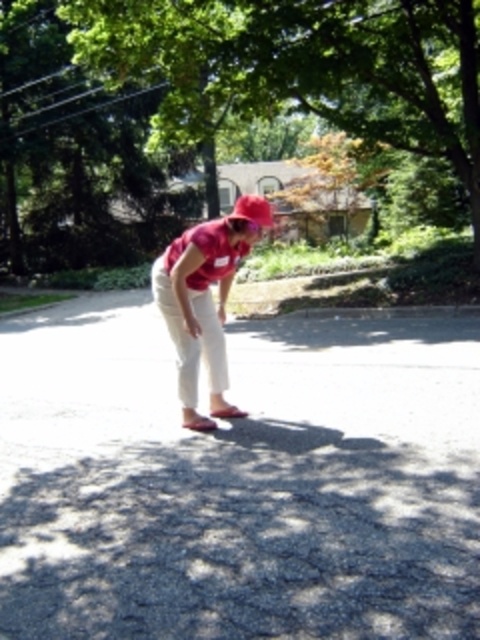
Question: Among these points, which one is nearest to the camera?

Choices:
 (A) (212, 385)
 (B) (203, 88)
 (C) (247, 195)

Answer: (A)

Question: Is matte red cap at center to the left of pink fabric hat at center from the viewer's perspective?

Choices:
 (A) no
 (B) yes

Answer: (B)

Question: Can you confirm if green leafy tree at upper center is positioned above pink fabric hat at center?

Choices:
 (A) yes
 (B) no

Answer: (A)

Question: Which object appears closest to the camera in this image?

Choices:
 (A) matte red cap at center
 (B) green leafy tree at upper center
 (C) pink fabric hat at center

Answer: (A)

Question: Among these points, which one is nearest to the camera?

Choices:
 (A) (149, 204)
 (B) (155, 285)

Answer: (B)

Question: Where is matte red cap at center located in relation to pink fabric hat at center in the image?

Choices:
 (A) below
 (B) above

Answer: (A)